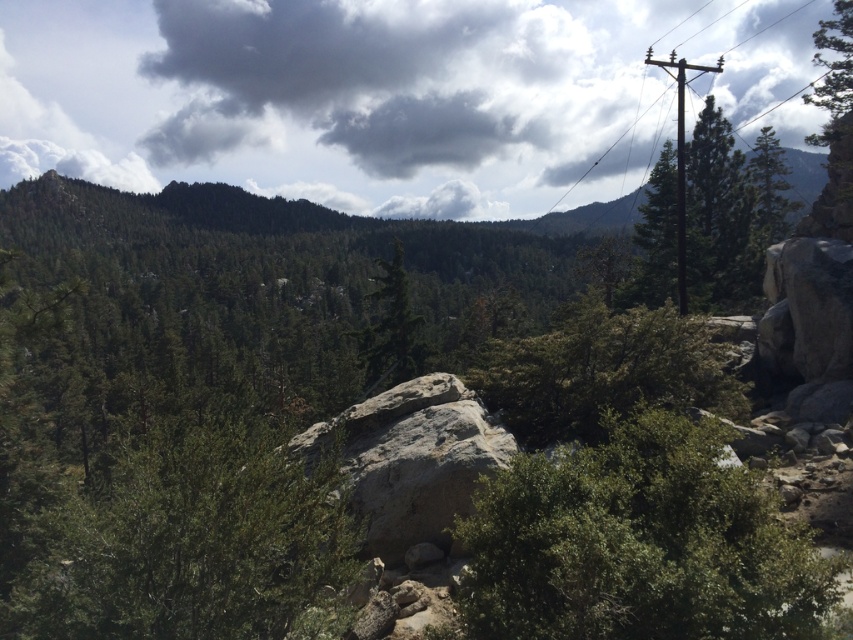
You are a hiker who wants to take a photo of the green matte tree at center and the brown wooden pole at upper right. Which object should you focus on first if you want to capture both in one frame without moving your camera?

The green matte tree at center is not as tall as the brown wooden pole at upper right, so you should focus on the brown wooden pole at upper right first to ensure both are in frame.

Looking at this image, you are a hiker planning to take a photo of the green leafy bush at center from the dark gray cloud at upper center. Given that your camera has a maximum range of 2000 feet, will you be able to capture the bush clearly?

The distance between the dark gray cloud at upper center and the green leafy bush at center is 2040.84 feet, which exceeds the camera maximum range of 2000 feet. Therefore, you won not be able to capture the bush clearly.

You are an outdoor photographer planning to capture a landscape shot of the green matte tree at center and the brown wooden pole at upper right. Since you want both subjects to be in focus, which one should you focus on first to ensure proper depth of field?

You should focus on the green matte tree at center first because it is closer to the camera than the brown wooden pole at upper right, allowing the depth of field to extend backward to include the pole in focus.